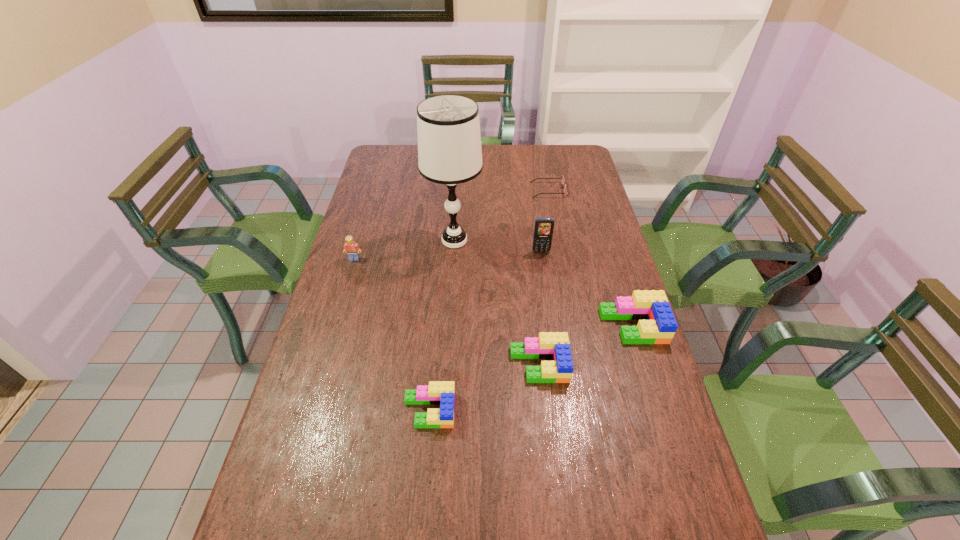
Locate an element on the screen. The height and width of the screenshot is (540, 960). vacant position located 0.320m on the bridge of the farthest object is located at coordinates (452, 190).

In order to click on object that is at the left edge in this screenshot , I will do `click(352, 248)`.

You are a GUI agent. You are given a task and a screenshot of the screen. Output one action in this format:
    pyautogui.click(x=<x>, y=<y>)
    Task: Click on the Lego that is at the right edge
    This screenshot has width=960, height=540.
    Given the screenshot: What is the action you would take?
    pyautogui.click(x=657, y=325)

Locate an element on the screen. The image size is (960, 540). sunglasses located at the right edge is located at coordinates (562, 178).

The height and width of the screenshot is (540, 960). I want to click on vacant space at the far edge, so click(x=514, y=167).

Image resolution: width=960 pixels, height=540 pixels. What are the coordinates of `vacant space at the left edge of the desktop` in the screenshot? It's located at (359, 226).

You are a GUI agent. You are given a task and a screenshot of the screen. Output one action in this format:
    pyautogui.click(x=<x>, y=<y>)
    Task: Click on the vacant space at the right edge
    This screenshot has width=960, height=540.
    Given the screenshot: What is the action you would take?
    pyautogui.click(x=624, y=291)

This screenshot has width=960, height=540. In order to click on vacant space at the far left corner in this screenshot , I will do `click(390, 170)`.

In the image, there is a desktop. In order to click on free space at the far right corner in this screenshot , I will do pos(582,151).

In order to click on blank region between the second nearest object and the fifth farthest object in this screenshot , I will do `click(586, 345)`.